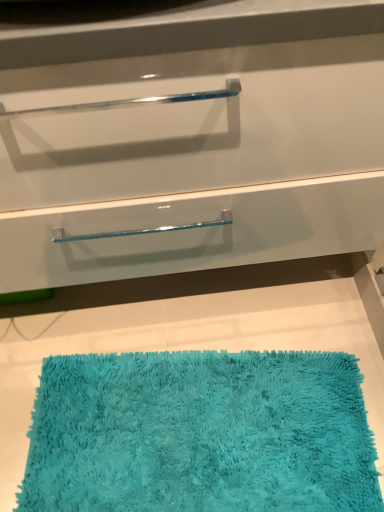
Question: Is turquoise shaggy bath mat at lower center in front of or behind clear glass drawer at center in the image?

Choices:
 (A) front
 (B) behind

Answer: (B)

Question: From the image's perspective, is turquoise shaggy bath mat at lower center located above or below clear glass drawer at center?

Choices:
 (A) below
 (B) above

Answer: (A)

Question: From a real-world perspective, is turquoise shaggy bath mat at lower center above or below clear glass drawer at center?

Choices:
 (A) above
 (B) below

Answer: (B)

Question: In terms of size, does clear glass drawer at center appear bigger or smaller than turquoise shaggy bath mat at lower center?

Choices:
 (A) big
 (B) small

Answer: (A)

Question: In terms of height, does clear glass drawer at center look taller or shorter compared to turquoise shaggy bath mat at lower center?

Choices:
 (A) tall
 (B) short

Answer: (A)

Question: Visually, is clear glass drawer at center positioned to the left or to the right of turquoise shaggy bath mat at lower center?

Choices:
 (A) left
 (B) right

Answer: (A)

Question: From the image's perspective, is clear glass drawer at center positioned above or below turquoise shaggy bath mat at lower center?

Choices:
 (A) below
 (B) above

Answer: (B)